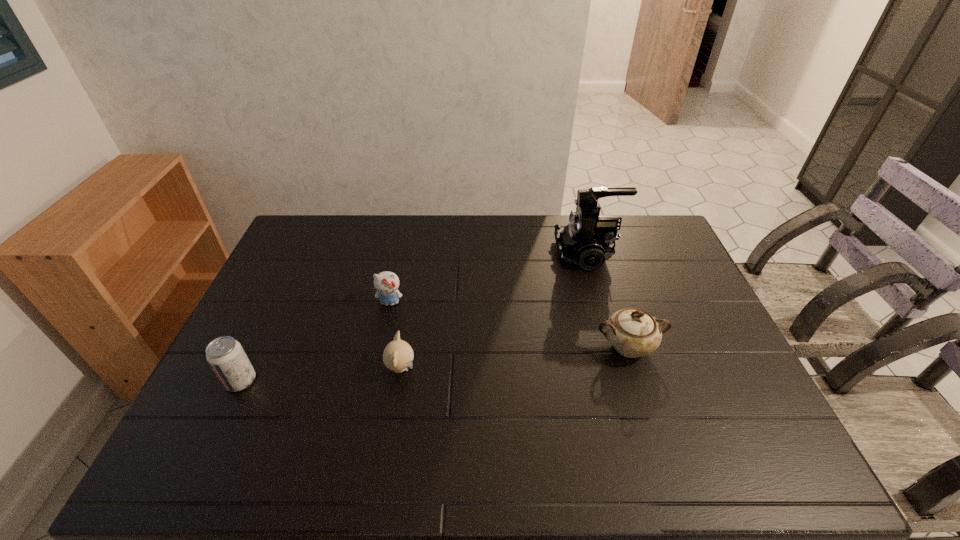
The width and height of the screenshot is (960, 540). I want to click on vacant space located 0.320m on the left of the chinaware, so click(480, 347).

Find the location of a particular element. free location located on the back of the leftmost object is located at coordinates (272, 316).

Where is `vacant space positioned on the front-facing side of the second farthest object`? This screenshot has height=540, width=960. vacant space positioned on the front-facing side of the second farthest object is located at coordinates (383, 333).

The width and height of the screenshot is (960, 540). Identify the location of vacant space located 0.170m on the face of the nearer kitten. (478, 368).

In order to click on object at the far edge in this screenshot , I will do `click(587, 240)`.

Where is `object situated at the left edge`? This screenshot has width=960, height=540. object situated at the left edge is located at coordinates (225, 355).

Find the location of a particular element. free space at the far edge of the desktop is located at coordinates (506, 216).

You are a GUI agent. You are given a task and a screenshot of the screen. Output one action in this format:
    pyautogui.click(x=<x>, y=<y>)
    Task: Click on the vacant region at the near edge of the desktop
    This screenshot has width=960, height=540.
    Given the screenshot: What is the action you would take?
    pyautogui.click(x=366, y=461)

Locate an element on the screen. The image size is (960, 540). blank space at the right edge of the desktop is located at coordinates (677, 271).

Find the location of a particular element. vacant space at the far left corner of the desktop is located at coordinates (325, 247).